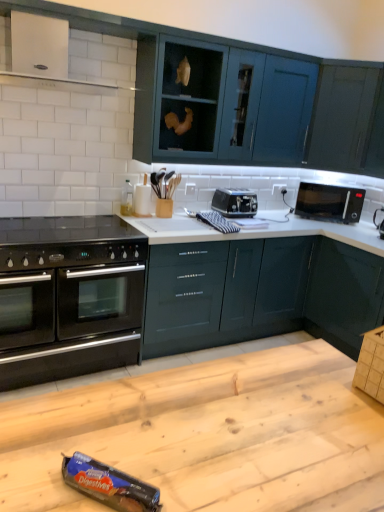
Question: From a real-world perspective, relative to glossy dark teal cabinets at center, which appears as the 3th cabinetry when viewed from the top, is black glass gas stove at lower left vertically above or below?

Choices:
 (A) below
 (B) above

Answer: (B)

Question: Considering the positions of black glass gas stove at lower left and glossy dark teal cabinets at center, the second cabinetry ordered from the bottom, in the image, is black glass gas stove at lower left bigger or smaller than glossy dark teal cabinets at center, the second cabinetry ordered from the bottom,?

Choices:
 (A) big
 (B) small

Answer: (B)

Question: Considering the real-world distances, which object is closest to the teal glossy cabinets at upper center, the third cabinetry from the bottom?

Choices:
 (A) satin black toaster at center, which is the 2th appliance in right-to-left order
 (B) glossy dark teal cabinets at center, which appears as the 3th cabinetry when viewed from the top
 (C) glossy dark green cabinet at lower right, the 1th cabinetry from the bottom
 (D) blue cardboard digestives at lower center, the third appliance positioned from the top
 (E) black glossy microwave at upper right

Answer: (E)

Question: Which of these objects is positioned farthest from the black plastic microwave at upper right, the second appliance in the bottom-to-top sequence?

Choices:
 (A) glossy dark teal cabinet at upper right, marked as the fourth cabinetry in a bottom-to-top arrangement
 (B) blue cardboard digestives at lower center, marked as the 1th appliance in a left-to-right arrangement
 (C) wooden table at center
 (D) brown cardboard box at lower right
 (E) black glass gas stove at lower left

Answer: (B)